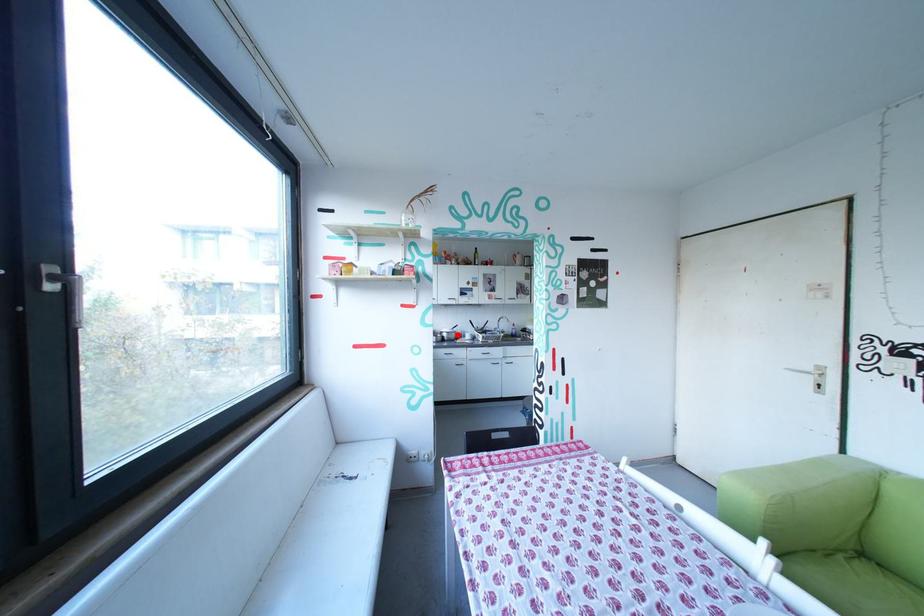
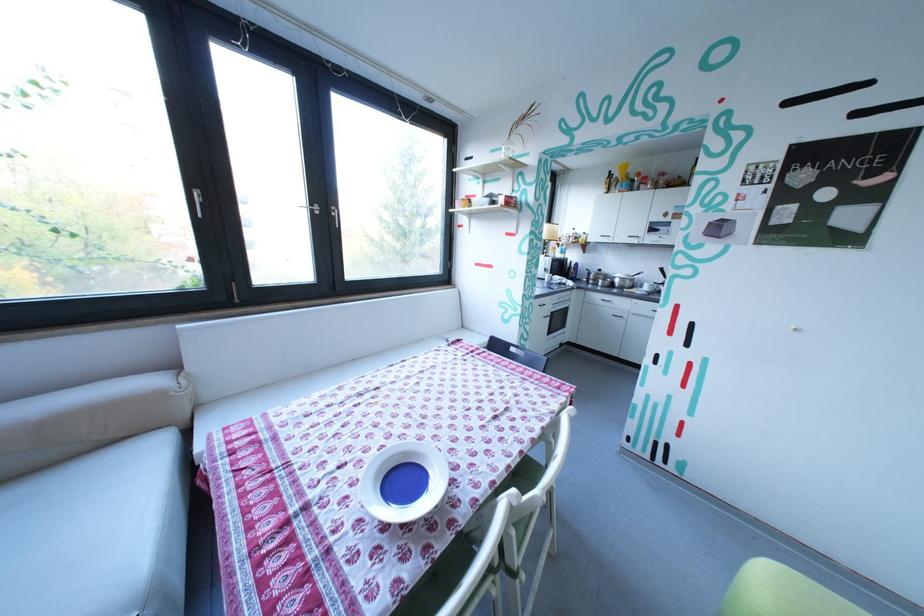
Find the pixel in the second image that matches the highlighted location in the first image.

(629, 281)